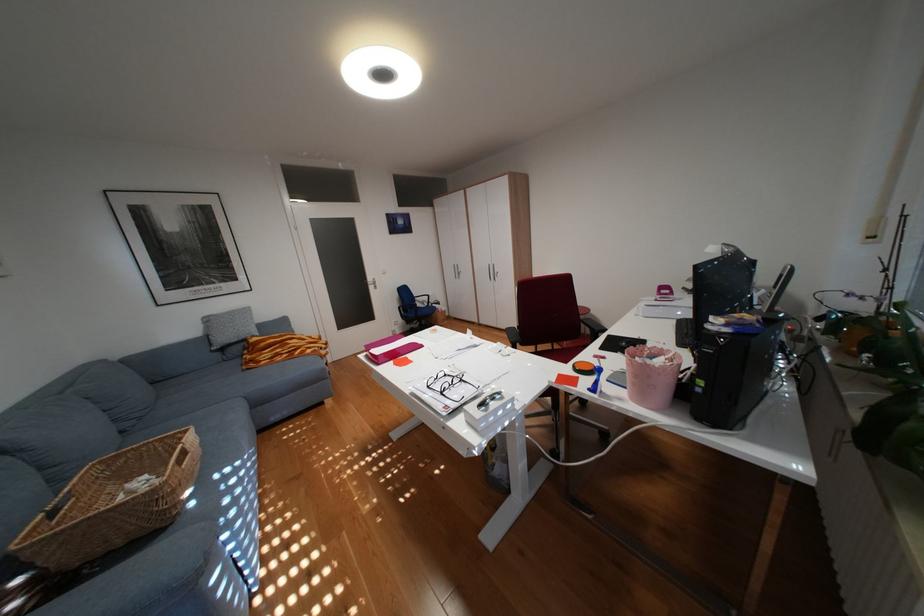
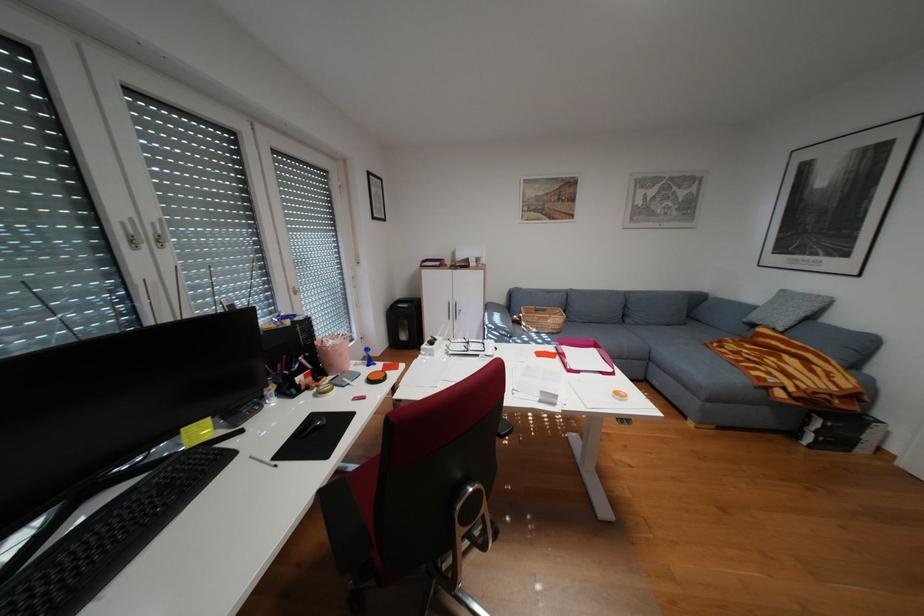
In the second image, find the point that corresponds to pixel 322 347 in the first image.

(782, 373)